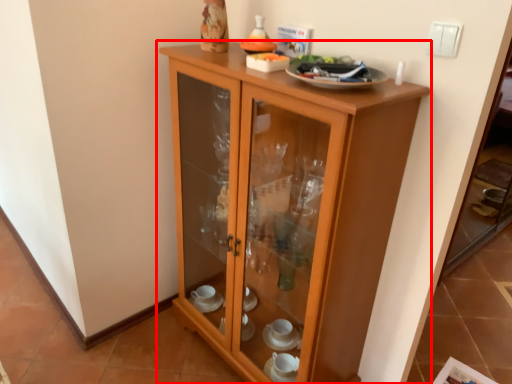
Question: Observing the image, what is the correct spatial positioning of cupboard (annotated by the red box) in reference to light switch?

Choices:
 (A) left
 (B) right

Answer: (A)